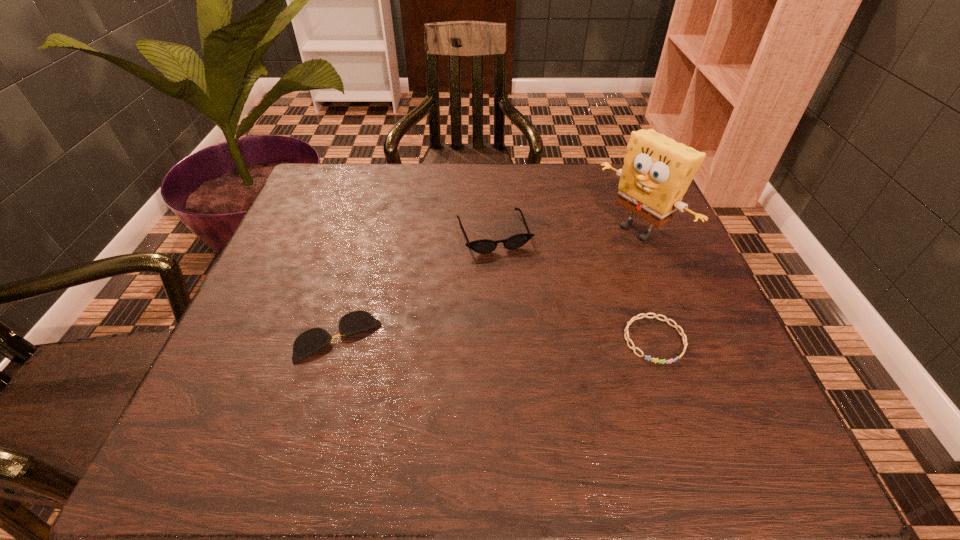
Where is `vacant area between the spectacles and the bracelet`? The image size is (960, 540). vacant area between the spectacles and the bracelet is located at coordinates (496, 339).

You are a GUI agent. You are given a task and a screenshot of the screen. Output one action in this format:
    pyautogui.click(x=<x>, y=<y>)
    Task: Click on the free space between the spectacles and the bracelet
    The width and height of the screenshot is (960, 540).
    Given the screenshot: What is the action you would take?
    pyautogui.click(x=496, y=339)

Find the location of `the second closest object relative to the tallest object`. the second closest object relative to the tallest object is located at coordinates (483, 246).

The width and height of the screenshot is (960, 540). In order to click on object that is the second nearest to the second shortest object in this screenshot , I will do `click(483, 246)`.

The image size is (960, 540). Find the location of `free location that satisfies the following two spatial constraints: 1. on the back side of the spectacles; 2. on the left side of the second object from left to right`. free location that satisfies the following two spatial constraints: 1. on the back side of the spectacles; 2. on the left side of the second object from left to right is located at coordinates (368, 233).

This screenshot has height=540, width=960. I want to click on vacant point that satisfies the following two spatial constraints: 1. on the back side of the sunglasses; 2. on the right side of the tallest object, so click(x=493, y=230).

Find the location of a particular element. Image resolution: width=960 pixels, height=540 pixels. blank space that satisfies the following two spatial constraints: 1. on the back side of the shortest object; 2. on the left side of the sponge is located at coordinates (369, 230).

Find the location of a particular element. vacant space that satisfies the following two spatial constraints: 1. on the back side of the tallest object; 2. on the left side of the spectacles is located at coordinates (369, 230).